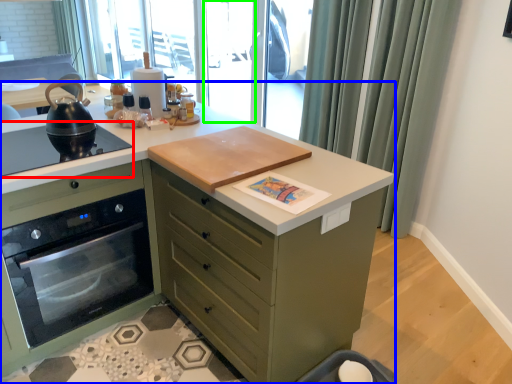
Question: Based on their relative distances, which object is nearer to gas stove (highlighted by a red box)? Choose from countertop (highlighted by a blue box) and screen door (highlighted by a green box).

Choices:
 (A) countertop
 (B) screen door

Answer: (A)